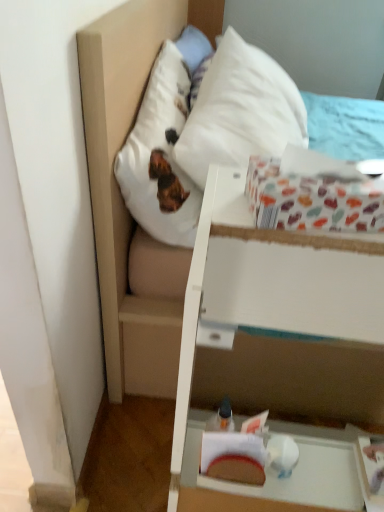
Question: Considering the relative sizes of multicolored paper at upper right and white matte vanity at lower right in the image provided, is multicolored paper at upper right bigger than white matte vanity at lower right?

Choices:
 (A) no
 (B) yes

Answer: (A)

Question: Considering the relative positions of multicolored paper at upper right and white matte vanity at lower right in the image provided, is multicolored paper at upper right to the right of white matte vanity at lower right from the viewer's perspective?

Choices:
 (A) no
 (B) yes

Answer: (A)

Question: Is multicolored paper at upper right completely or partially outside of white matte vanity at lower right?

Choices:
 (A) yes
 (B) no

Answer: (A)

Question: Is multicolored paper at upper right taller than white matte vanity at lower right?

Choices:
 (A) no
 (B) yes

Answer: (A)

Question: Considering the relative sizes of multicolored paper at upper right and white matte vanity at lower right in the image provided, is multicolored paper at upper right wider than white matte vanity at lower right?

Choices:
 (A) yes
 (B) no

Answer: (B)

Question: In terms of width, does multicolored paper at upper right look wider or thinner when compared to white matte vanity at lower right?

Choices:
 (A) wide
 (B) thin

Answer: (B)

Question: Is point (x=266, y=224) positioned closer to the camera than point (x=215, y=288)?

Choices:
 (A) farther
 (B) closer

Answer: (B)

Question: Is multicolored paper at upper right taller or shorter than white matte vanity at lower right?

Choices:
 (A) short
 (B) tall

Answer: (A)

Question: Visually, is multicolored paper at upper right positioned to the left or to the right of white matte vanity at lower right?

Choices:
 (A) left
 (B) right

Answer: (A)

Question: Is point (375, 182) closer or farther from the camera than point (291, 87)?

Choices:
 (A) farther
 (B) closer

Answer: (B)

Question: In terms of height, does multicolored paper at upper right look taller or shorter compared to white soft pillow at upper center?

Choices:
 (A) short
 (B) tall

Answer: (A)

Question: From the image's perspective, is multicolored paper at upper right above or below white soft pillow at upper center?

Choices:
 (A) below
 (B) above

Answer: (A)

Question: In terms of size, does multicolored paper at upper right appear bigger or smaller than white soft pillow at upper center?

Choices:
 (A) big
 (B) small

Answer: (B)

Question: From their relative heights in the image, would you say white matte vanity at lower right is taller or shorter than white soft pillow at upper center?

Choices:
 (A) short
 (B) tall

Answer: (B)

Question: Is white matte vanity at lower right wider or thinner than white soft pillow at upper center?

Choices:
 (A) wide
 (B) thin

Answer: (B)